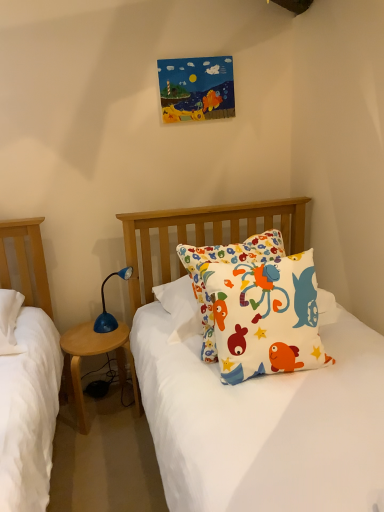
Where is `vacant area that is in front of blue plastic lamp at lower left`? vacant area that is in front of blue plastic lamp at lower left is located at coordinates (99, 343).